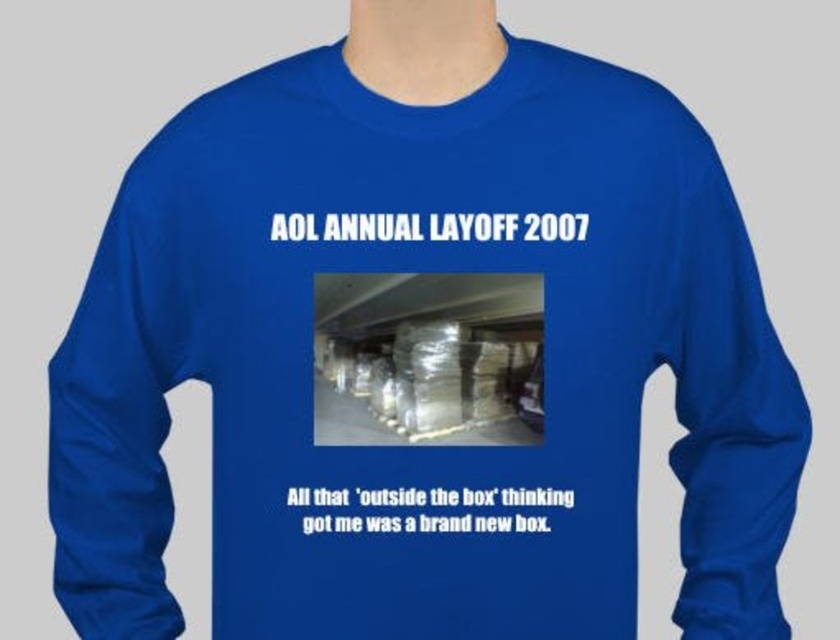
Question: Which point is closer to the camera taking this photo?

Choices:
 (A) (765, 461)
 (B) (132, 486)

Answer: (B)

Question: Does royal blue fabric sleeve at left have a larger size compared to royal blue fabric sleeve at right?

Choices:
 (A) no
 (B) yes

Answer: (A)

Question: Is royal blue fabric sleeve at left positioned before royal blue fabric sleeve at right?

Choices:
 (A) yes
 (B) no

Answer: (A)

Question: Is royal blue fabric sleeve at left to the left of royal blue fabric sleeve at right from the viewer's perspective?

Choices:
 (A) no
 (B) yes

Answer: (B)